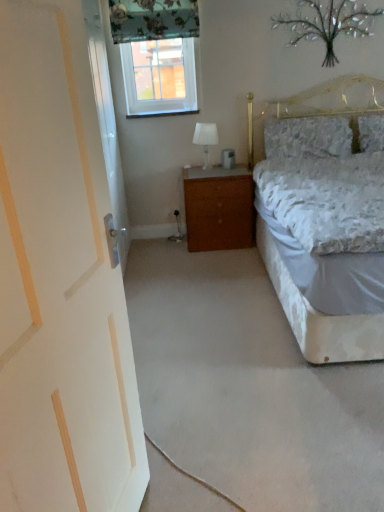
Locate an element on the screen. unoccupied region to the right of white glossy door at left is located at coordinates (173, 255).